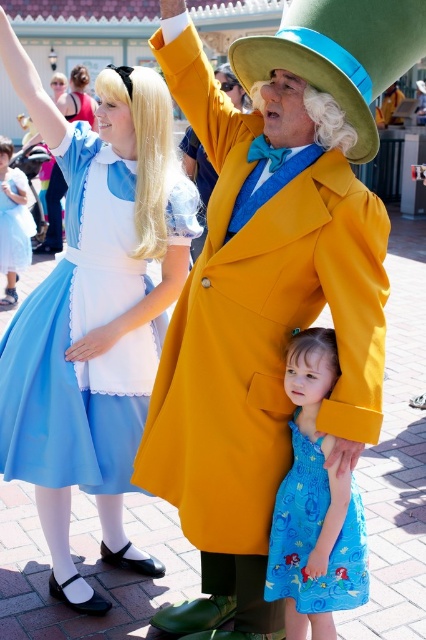
You are a photographer trying to capture a clear shot of both the matte yellow coat at center and the matte blue fabric dress at left. Which object should you focus on first to ensure both are in focus?

You should focus on the matte yellow coat at center first since it is closer to the viewer than the matte blue fabric dress at left, allowing the camera to adjust focus starting from the nearest object.

You are a photographer at the event and want to capture both the matte yellow coat at center and the matte blue fabric dress at left in a single photo. The camera has a maximum focus range of 28 inches. Will both subjects be in focus?

The matte yellow coat at center and matte blue fabric dress at left are 27.75 inches apart, which is within the camera maximum focus range of 28 inches. Therefore, both subjects will be in focus.